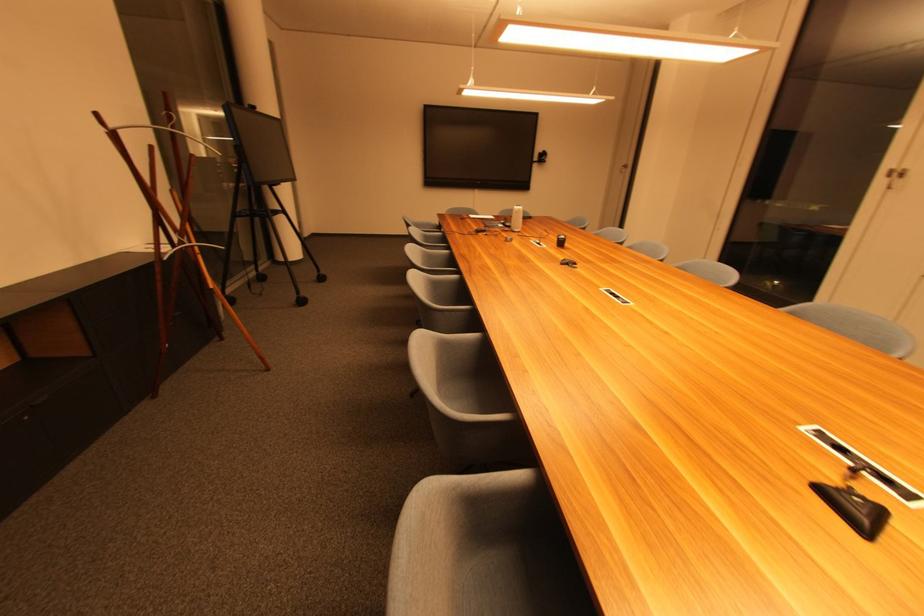
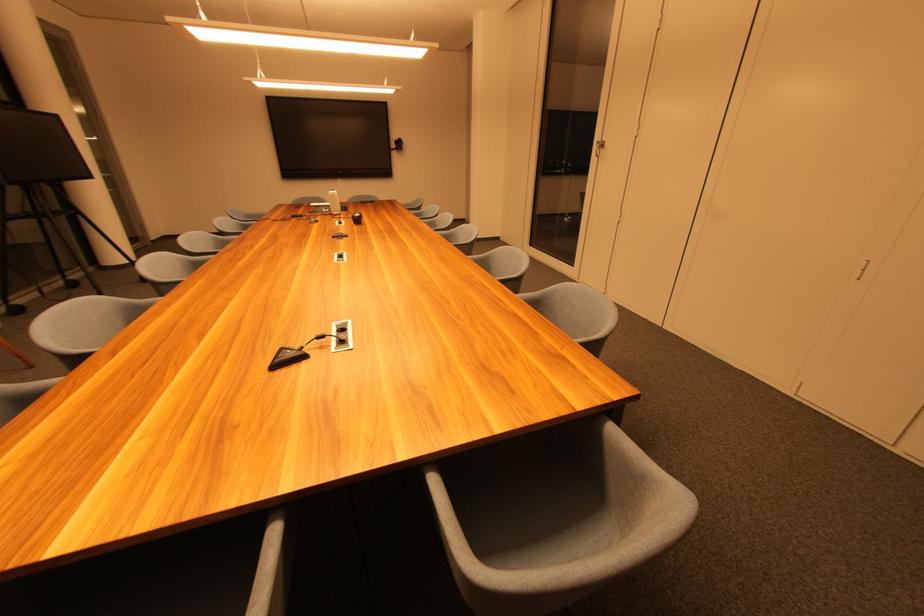
The point at (525,211) is marked in the first image. Where is the corresponding point in the second image?

(337, 196)